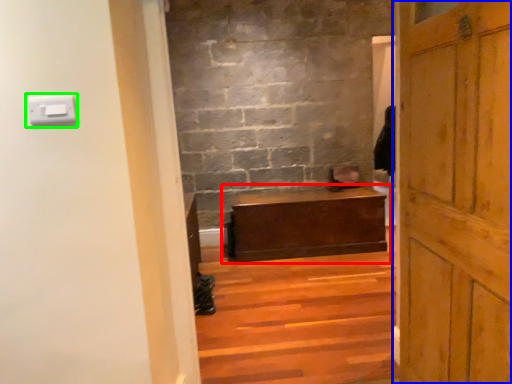
Question: Which is farther away from table (highlighted by a red box)? door (highlighted by a blue box) or light switch (highlighted by a green box)?

Choices:
 (A) door
 (B) light switch

Answer: (B)